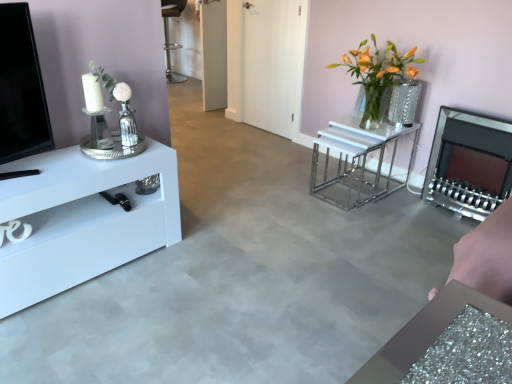
Question: Can you confirm if translucent glass vase at center right is positioned to the left of white glossy nesting tables at center, which is counted as the second table, starting from the left?

Choices:
 (A) no
 (B) yes

Answer: (B)

Question: Could you tell me if translucent glass vase at center right is turned towards white glossy nesting tables at center, which is counted as the second table, starting from the front?

Choices:
 (A) no
 (B) yes

Answer: (A)

Question: Considering the relative sizes of translucent glass vase at center right and white glossy nesting tables at center, arranged as the first table when viewed from the back, in the image provided, is translucent glass vase at center right shorter than white glossy nesting tables at center, arranged as the first table when viewed from the back,?

Choices:
 (A) yes
 (B) no

Answer: (B)

Question: Is white glossy nesting tables at center, arranged as the first table when viewed from the right, at the back of translucent glass vase at center right?

Choices:
 (A) no
 (B) yes

Answer: (A)

Question: Does translucent glass vase at center right have a larger size compared to white glossy nesting tables at center, arranged as the first table when viewed from the right?

Choices:
 (A) no
 (B) yes

Answer: (B)

Question: From a real-world perspective, is translucent glass vase at center right physically located above or below white glossy tv stand at left, which is counted as the second table, starting from the back?

Choices:
 (A) above
 (B) below

Answer: (A)

Question: From the image's perspective, is translucent glass vase at center right located above or below white glossy tv stand at left, which appears as the second table when viewed from the right?

Choices:
 (A) below
 (B) above

Answer: (B)

Question: Does point (369, 84) appear closer or farther from the camera than point (27, 188)?

Choices:
 (A) farther
 (B) closer

Answer: (A)

Question: Considering the positions of translucent glass vase at center right and white glossy tv stand at left, acting as the first table starting from the left, in the image, is translucent glass vase at center right bigger or smaller than white glossy tv stand at left, acting as the first table starting from the left,?

Choices:
 (A) small
 (B) big

Answer: (A)

Question: In terms of height, does translucent glass vase at center right look taller or shorter compared to white glossy door at center?

Choices:
 (A) tall
 (B) short

Answer: (B)

Question: Considering the positions of translucent glass vase at center right and white glossy door at center in the image, is translucent glass vase at center right bigger or smaller than white glossy door at center?

Choices:
 (A) big
 (B) small

Answer: (A)

Question: Considering the positions of point (382, 89) and point (301, 18), is point (382, 89) closer or farther from the camera than point (301, 18)?

Choices:
 (A) farther
 (B) closer

Answer: (B)

Question: From the image's perspective, is translucent glass vase at center right positioned above or below white glossy door at center?

Choices:
 (A) above
 (B) below

Answer: (B)

Question: From the image's perspective, relative to clear glass vase at center, is matte black fireplace at right above or below?

Choices:
 (A) below
 (B) above

Answer: (A)

Question: Considering the relative positions of matte black fireplace at right and clear glass vase at center in the image provided, is matte black fireplace at right to the left or to the right of clear glass vase at center?

Choices:
 (A) left
 (B) right

Answer: (B)